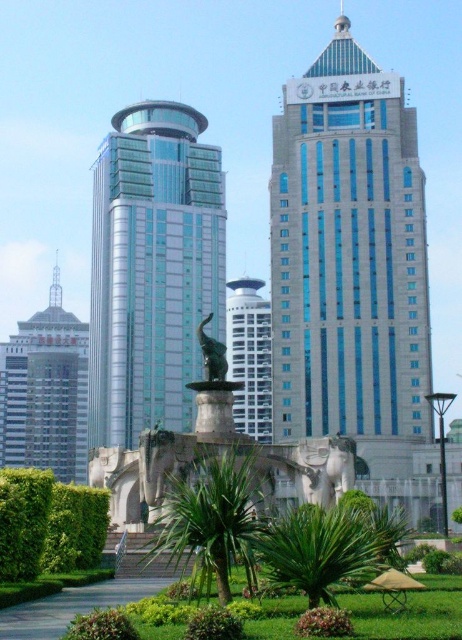
Is green glass building at center smaller than bronze statue at center?

No, green glass building at center is not smaller than bronze statue at center.

Locate an element on the screen. The image size is (462, 640). green glass building at center is located at coordinates (152, 269).

Where is `green glass building at center`? green glass building at center is located at coordinates (152, 269).

Describe the element at coordinates (152, 269) in the screenshot. I see `green glass building at center` at that location.

Image resolution: width=462 pixels, height=640 pixels. Find the location of `green glass building at center`. green glass building at center is located at coordinates (152, 269).

Which is below, light gray glass skyscraper at center or green glass building at center?

green glass building at center

Which of these two, light gray glass skyscraper at center or green glass building at center, stands shorter?

With less height is green glass building at center.

Measure the distance between light gray glass skyscraper at center and camera.

light gray glass skyscraper at center and camera are 327.17 feet apart.

I want to click on light gray glass skyscraper at center, so click(x=350, y=262).